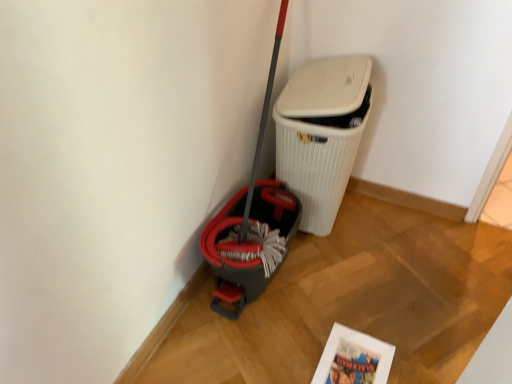
At what (x,y) coordinates should I click in order to perform the action: click on blank space to the left of matte white comic book at lower center. Please return your answer as a coordinate pair (x, y). This screenshot has width=512, height=384. Looking at the image, I should click on (285, 347).